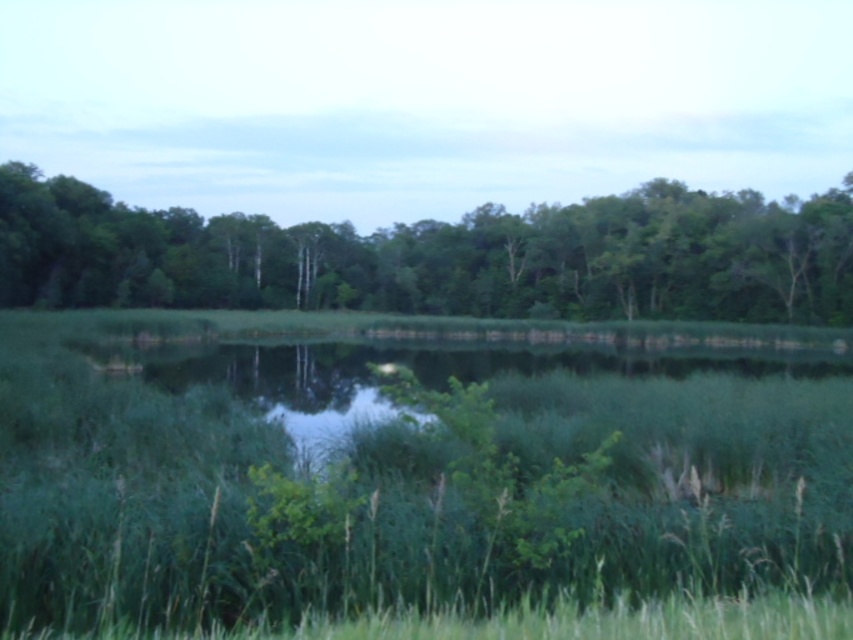
Can you confirm if green grass at center is shorter than green leafy trees at center?

Yes, green grass at center is shorter than green leafy trees at center.

Locate an element on the screen. This screenshot has height=640, width=853. green grass at center is located at coordinates (416, 470).